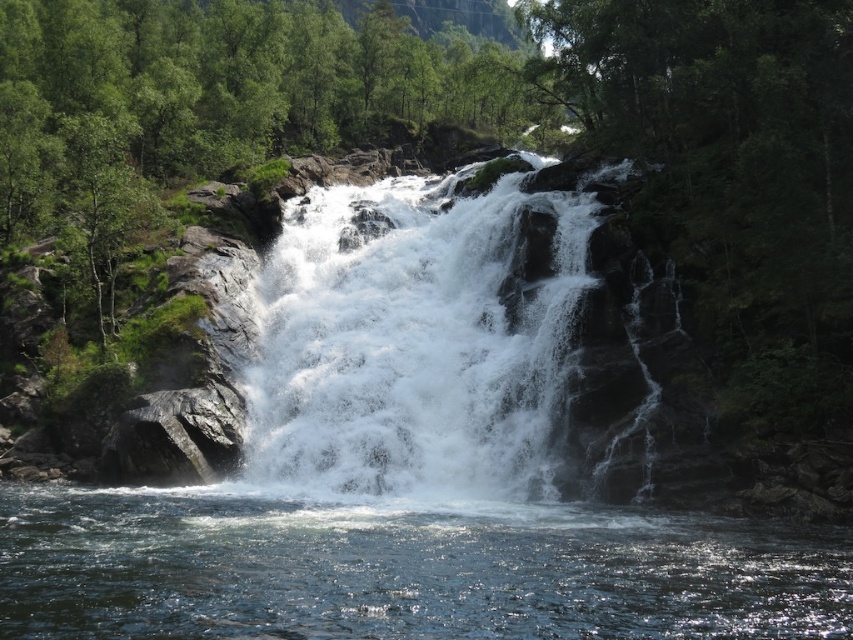
You are a drone operator trying to capture footage of the waterfall. Your drone has a camera with a maximum zoom range of 15 meters. If you position the drone above the clear water at center, can you clearly capture the white frothy water at center in the same frame without moving the drone?

The distance between the clear water at center and the white frothy water at center is 18.83 meters. Since the drone camera can only zoom up to 15 meters, it cannot capture both in the same frame without moving the drone.

You are standing at the edge of the waterfall and see a point marked at coordinates (221, 106). What object is located at that point?

The point at coordinates (221, 106) indicates a green leafy tree at center.

You are standing at the edge of the waterfall and want to locate the clear water at center. According to the coordinates provided, where exactly should you look to find it?

The clear water at center is located at point coordinates 0.889 on the x axis and 0.472 on the y axis.